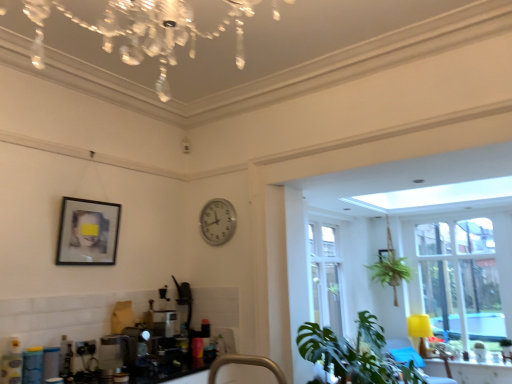
Question: From a real-world perspective, is clear glass window at right located beneath matte black picture frame at upper right, the first picture frame from the right?

Choices:
 (A) no
 (B) yes

Answer: (B)

Question: Can you confirm if clear glass window at right is thinner than matte black picture frame at upper right, acting as the 2th picture frame starting from the top?

Choices:
 (A) yes
 (B) no

Answer: (B)

Question: Does clear glass window at right have a smaller size compared to matte black picture frame at upper right, the first picture frame from the right?

Choices:
 (A) yes
 (B) no

Answer: (B)

Question: From the image's perspective, does clear glass window at right appear lower than matte black picture frame at upper right, the 2th picture frame viewed from the left?

Choices:
 (A) yes
 (B) no

Answer: (A)

Question: Is clear glass window at right to the left of matte black picture frame at upper right, placed as the 1th picture frame when sorted from bottom to top, from the viewer's perspective?

Choices:
 (A) no
 (B) yes

Answer: (A)

Question: In the image, is crystal glass chandelier at upper center positioned in front of or behind brushed metal faucet at lower center?

Choices:
 (A) front
 (B) behind

Answer: (B)

Question: Considering the positions of crystal glass chandelier at upper center and brushed metal faucet at lower center in the image, is crystal glass chandelier at upper center taller or shorter than brushed metal faucet at lower center?

Choices:
 (A) short
 (B) tall

Answer: (A)

Question: From the image's perspective, is crystal glass chandelier at upper center positioned above or below brushed metal faucet at lower center?

Choices:
 (A) above
 (B) below

Answer: (A)

Question: Is crystal glass chandelier at upper center inside or outside of brushed metal faucet at lower center?

Choices:
 (A) outside
 (B) inside

Answer: (A)

Question: Is point click(379, 248) closer or farther from the camera than point click(126, 362)?

Choices:
 (A) closer
 (B) farther

Answer: (B)

Question: Based on their positions, is matte black picture frame at upper right, the second picture frame when ordered from front to back, located to the left or right of satin silver toaster at lower left?

Choices:
 (A) right
 (B) left

Answer: (A)

Question: Considering the positions of matte black picture frame at upper right, the first picture frame from the right, and satin silver toaster at lower left in the image, is matte black picture frame at upper right, the first picture frame from the right, taller or shorter than satin silver toaster at lower left?

Choices:
 (A) tall
 (B) short

Answer: (B)

Question: Would you say matte black picture frame at upper right, the first picture frame from the right, is inside or outside satin silver toaster at lower left?

Choices:
 (A) outside
 (B) inside

Answer: (A)

Question: Considering the positions of crystal glass chandelier at upper center and yellow matte lamp at right in the image, is crystal glass chandelier at upper center wider or thinner than yellow matte lamp at right?

Choices:
 (A) thin
 (B) wide

Answer: (B)

Question: In the image, is crystal glass chandelier at upper center on the left side or the right side of yellow matte lamp at right?

Choices:
 (A) left
 (B) right

Answer: (A)